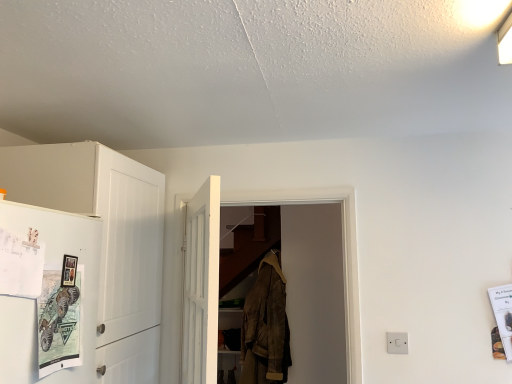
Question: Is white plastic switch at lower right turned away from white wooden door at center, the second door positioned from the back?

Choices:
 (A) yes
 (B) no

Answer: (B)

Question: From a real-world perspective, is white plastic switch at lower right physically above white wooden door at center, which is counted as the first door, starting from the front?

Choices:
 (A) yes
 (B) no

Answer: (B)

Question: Could white wooden door at center, the second door positioned from the back, be considered to be inside white plastic switch at lower right?

Choices:
 (A) yes
 (B) no

Answer: (B)

Question: Could you tell me if white plastic switch at lower right is turned towards white wooden door at center, the second door positioned from the back?

Choices:
 (A) yes
 (B) no

Answer: (B)

Question: Is white plastic switch at lower right positioned in front of white wooden door at center, the second door positioned from the back?

Choices:
 (A) yes
 (B) no

Answer: (B)

Question: Considering the relative positions of white wooden door at center, positioned as the second door in front-to-back order, and white matte cabinet at left in the image provided, is white wooden door at center, positioned as the second door in front-to-back order, to the left or to the right of white matte cabinet at left?

Choices:
 (A) left
 (B) right

Answer: (B)

Question: In the image, is white wooden door at center, positioned as the second door in front-to-back order, positioned in front of or behind white matte cabinet at left?

Choices:
 (A) behind
 (B) front

Answer: (A)

Question: Is white wooden door at center, the first door positioned from the back, taller or shorter than white matte cabinet at left?

Choices:
 (A) short
 (B) tall

Answer: (A)

Question: In terms of width, does white wooden door at center, the first door positioned from the back, look wider or thinner when compared to white matte cabinet at left?

Choices:
 (A) wide
 (B) thin

Answer: (B)

Question: From their relative heights in the image, would you say metallic poster at lower left is taller or shorter than white plastic switch at lower right?

Choices:
 (A) tall
 (B) short

Answer: (A)

Question: Is metallic poster at lower left to the left or to the right of white plastic switch at lower right in the image?

Choices:
 (A) right
 (B) left

Answer: (B)

Question: Is metallic poster at lower left in front of or behind white plastic switch at lower right in the image?

Choices:
 (A) behind
 (B) front

Answer: (B)

Question: From a real-world perspective, is metallic poster at lower left above or below white plastic switch at lower right?

Choices:
 (A) above
 (B) below

Answer: (A)

Question: From a real-world perspective, relative to metallic poster at lower left, is white glossy refrigerator at left vertically above or below?

Choices:
 (A) below
 (B) above

Answer: (B)

Question: Is white glossy refrigerator at left inside or outside of metallic poster at lower left?

Choices:
 (A) inside
 (B) outside

Answer: (A)